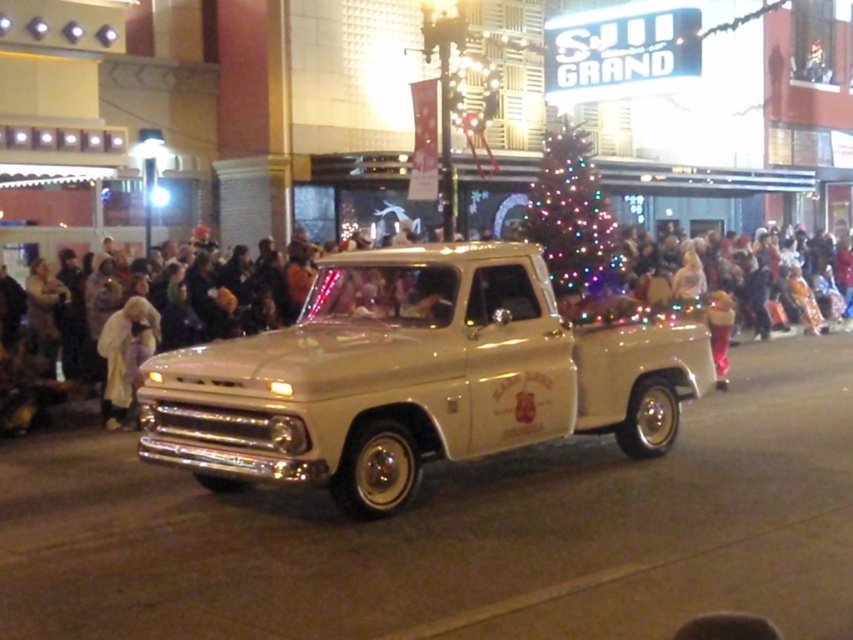
Does beige glossy truck at center have a lesser height compared to white fabric crowd at center?

In fact, beige glossy truck at center may be taller than white fabric crowd at center.

Which is behind, point (527, 275) or point (599, 304)?

The point (599, 304) is more distant.

Find the location of `beige glossy truck at center`. beige glossy truck at center is located at coordinates (416, 376).

Is white fabric crowd at center closer to camera compared to illuminated glass christmas tree at center?

That is True.

Who is positioned more to the left, white fabric crowd at center or illuminated glass christmas tree at center?

white fabric crowd at center

Does point (695, 337) lie behind point (572, 145)?

No.

At what (x,y) coordinates should I click in order to perform the action: click on white fabric crowd at center. Please return your answer as a coordinate pair (x, y). This screenshot has height=640, width=853. Looking at the image, I should click on point(637,355).

Between point (593, 412) and point (584, 292), which one is positioned in front?

Point (593, 412)

Locate an element on the screen. The width and height of the screenshot is (853, 640). beige glossy truck at center is located at coordinates (416, 376).

Find the location of `beige glossy truck at center`. beige glossy truck at center is located at coordinates (416, 376).